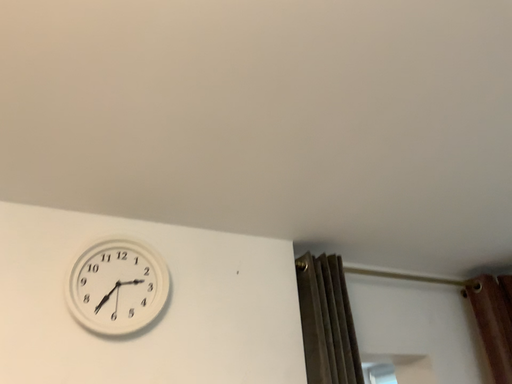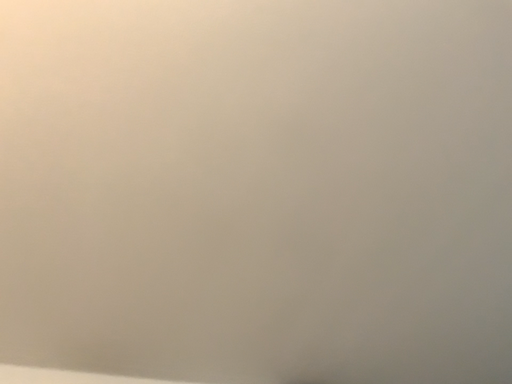
Question: Which way did the camera rotate in the video?

Choices:
 (A) rotated downward
 (B) rotated upward

Answer: (B)